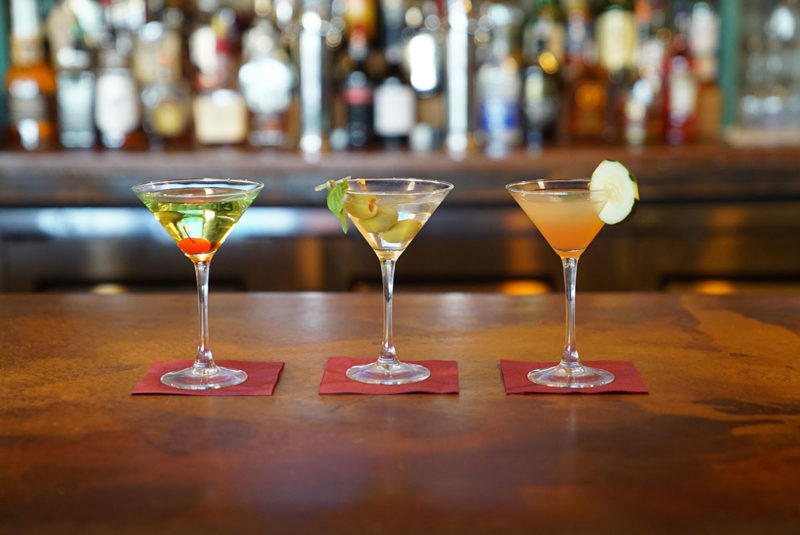
The width and height of the screenshot is (800, 535). Find the location of `table top`. table top is located at coordinates (473, 440).